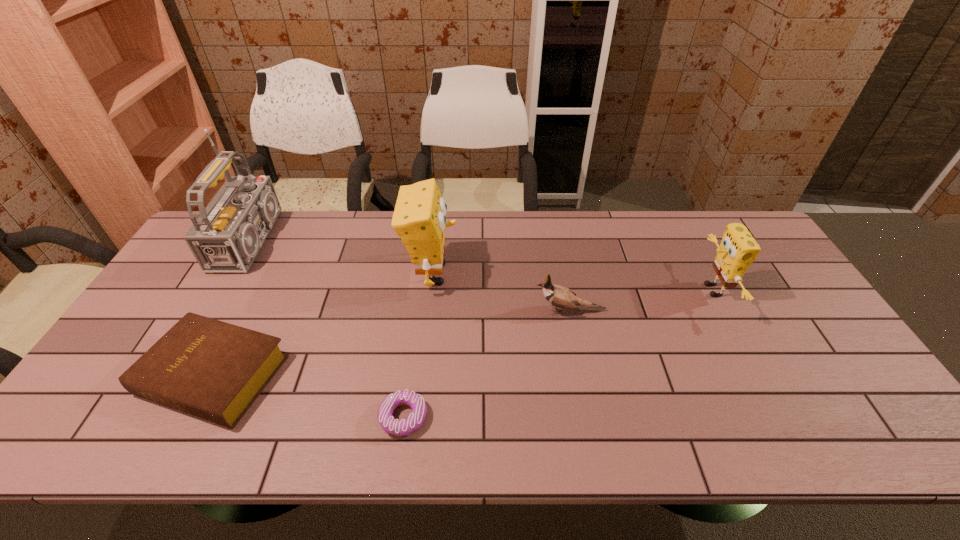
Identify the location of free spot at the right edge of the desktop. This screenshot has width=960, height=540. (825, 405).

Identify the location of blank space at the near right corner of the desktop. This screenshot has width=960, height=540. (864, 417).

At what (x,y) coordinates should I click in order to perform the action: click on vacant area that lies between the taller sponge and the bird. Please return your answer as a coordinate pair (x, y). Looking at the image, I should click on pyautogui.click(x=501, y=292).

Locate an element on the screen. Image resolution: width=960 pixels, height=540 pixels. free space that is in between the fourth tallest object and the right sponge is located at coordinates (640, 300).

The image size is (960, 540). I want to click on free space between the radio receiver and the Bible, so click(x=235, y=308).

Image resolution: width=960 pixels, height=540 pixels. In order to click on free space between the left sponge and the radio receiver in this screenshot , I will do `click(345, 256)`.

Find the location of a particular element. This screenshot has width=960, height=540. unoccupied area between the left sponge and the Bible is located at coordinates (323, 324).

I want to click on free area in between the rightmost object and the radio receiver, so (x=484, y=265).

The height and width of the screenshot is (540, 960). I want to click on free spot between the taller sponge and the third shortest object, so click(501, 292).

What are the coordinates of `vacant point located between the left sponge and the bird` in the screenshot? It's located at (501, 292).